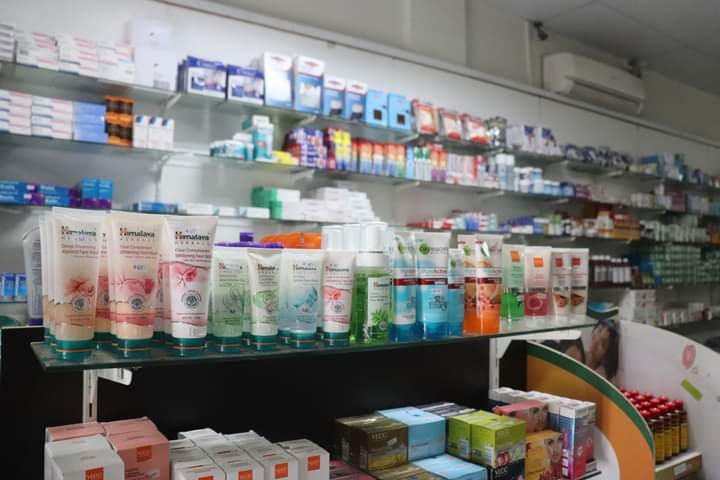
Find the location of a particular element. The image size is (720, 480). wall is located at coordinates (690, 111).